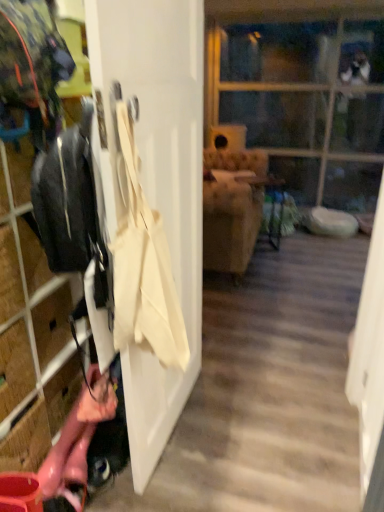
Question: In terms of width, does transparent glass door at upper center look wider or thinner when compared to white matte door at center?

Choices:
 (A) thin
 (B) wide

Answer: (B)

Question: Do you think transparent glass door at upper center is within white matte door at center, or outside of it?

Choices:
 (A) outside
 (B) inside

Answer: (A)

Question: Which of these objects is positioned closest to the transparent glass door at upper center?

Choices:
 (A) transparent plastic screen door at right
 (B) matte black jacket at left
 (C) white matte door at center
 (D) beige canvas tote at left

Answer: (A)

Question: Considering the real-world distances, which object is closest to the white matte door at center?

Choices:
 (A) transparent glass door at upper center
 (B) transparent plastic screen door at right
 (C) beige canvas tote at left
 (D) matte black jacket at left

Answer: (C)